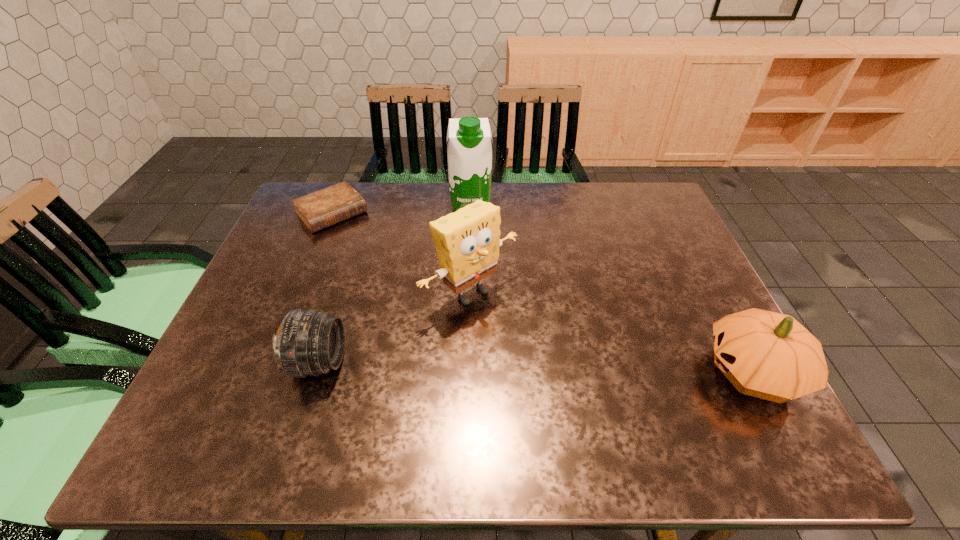
Locate an element on the screen. This screenshot has height=540, width=960. diary that is at the far edge is located at coordinates (321, 209).

Where is `soya milk at the far edge`? soya milk at the far edge is located at coordinates (469, 151).

The width and height of the screenshot is (960, 540). In order to click on telephoto lens present at the near edge in this screenshot , I will do `click(309, 342)`.

Identify the location of gourd at the near edge. coord(768,355).

You are a GUI agent. You are given a task and a screenshot of the screen. Output one action in this format:
    pyautogui.click(x=<x>, y=<y>)
    Task: Click on the object present at the left edge
    
    Given the screenshot: What is the action you would take?
    pyautogui.click(x=321, y=209)

The image size is (960, 540). I want to click on object present at the right edge, so click(x=768, y=355).

The image size is (960, 540). I want to click on object positioned at the far left corner, so click(x=321, y=209).

Find the location of a particular element. The image size is (960, 540). object present at the near right corner is located at coordinates (768, 355).

The height and width of the screenshot is (540, 960). In order to click on vacant space at the far edge of the desktop in this screenshot , I will do `click(437, 215)`.

You are a GUI agent. You are given a task and a screenshot of the screen. Output one action in this format:
    pyautogui.click(x=<x>, y=<y>)
    Task: Click on the free spot at the near edge of the desktop
    This screenshot has height=540, width=960.
    Given the screenshot: What is the action you would take?
    pyautogui.click(x=470, y=380)